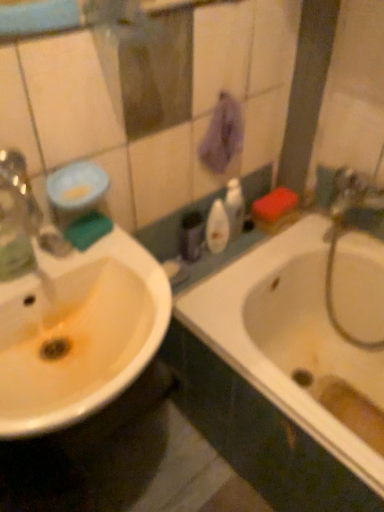
The image size is (384, 512). Find the location of `free space in front of translucent plastic mouthwash at center, marked as the 1th mouthwash in a right-to-left arrangement`. free space in front of translucent plastic mouthwash at center, marked as the 1th mouthwash in a right-to-left arrangement is located at coordinates (205, 272).